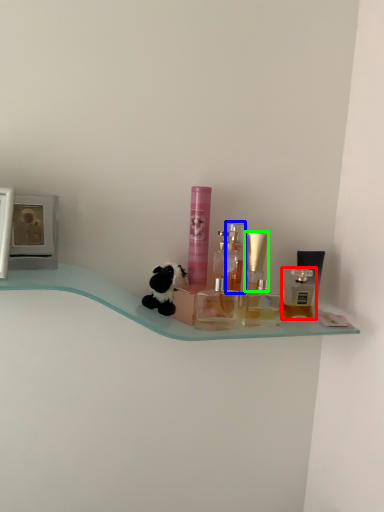
Question: Based on their relative distances, which object is farther from perfume (highlighted by a red box)? Choose from perfume (highlighted by a blue box) and perfume (highlighted by a green box).

Choices:
 (A) perfume
 (B) perfume

Answer: (A)